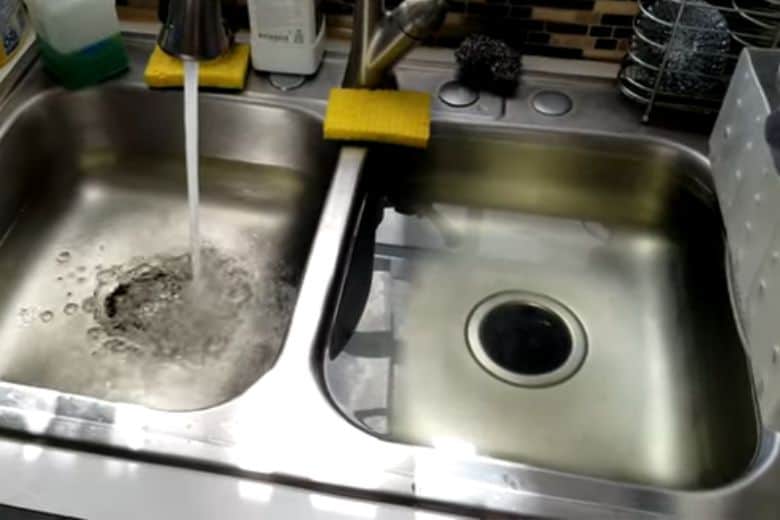
I want to click on sink filled with clear water, so click(431, 299).